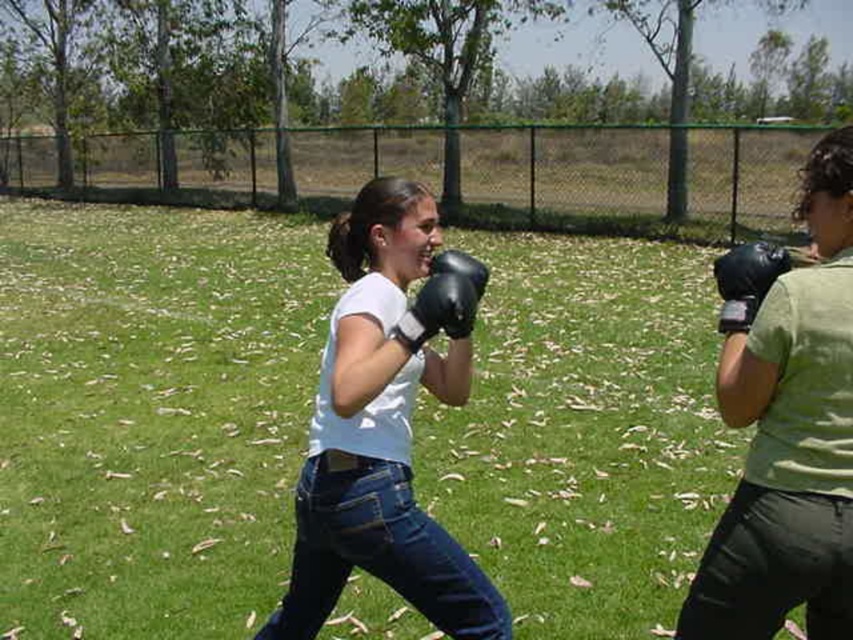
You are a boxing coach observing two gloves used by your students. The black leather boxing glove at center is worn by the student on the left, and the black synthetic glove at right is used by the student on the right. Which glove would you recommend for a beginner to ensure better comfort and control?

The black synthetic glove at right is smaller in size compared to the black leather boxing glove at center, making it more suitable for beginners who require a snugger fit for better control and comfort.